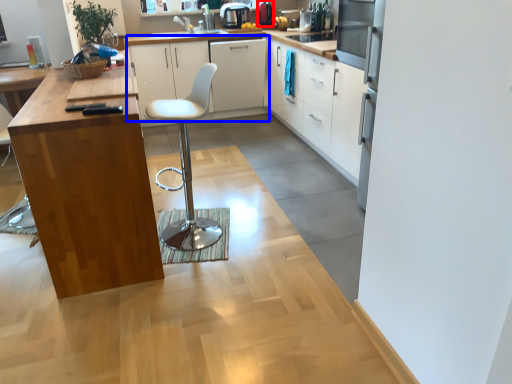
Question: Among these objects, which one is farthest to the camera, appliance (highlighted by a red box) or cabinetry (highlighted by a blue box)?

Choices:
 (A) appliance
 (B) cabinetry

Answer: (A)